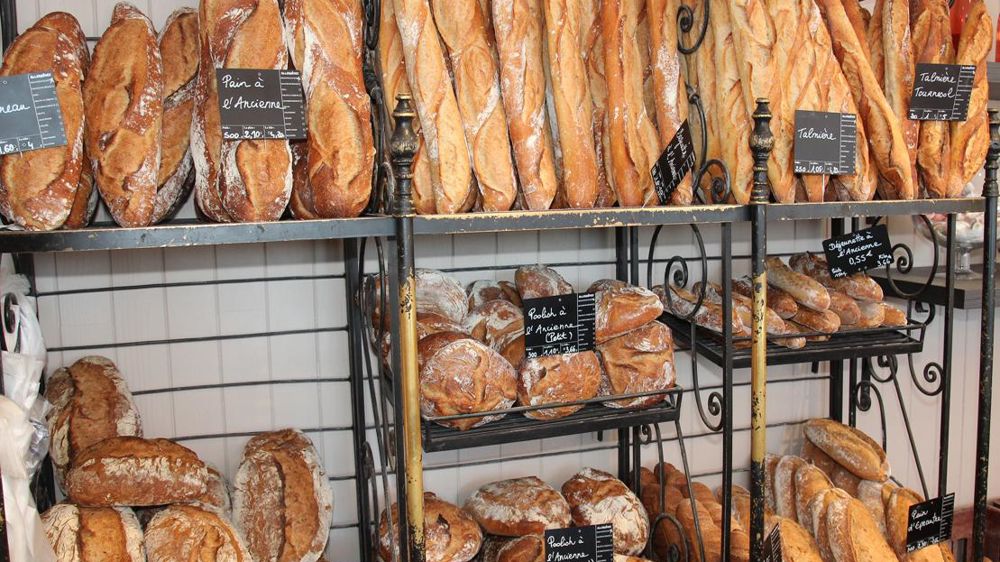
Where is `tile`? The width and height of the screenshot is (1000, 562). tile is located at coordinates pos(248,301).